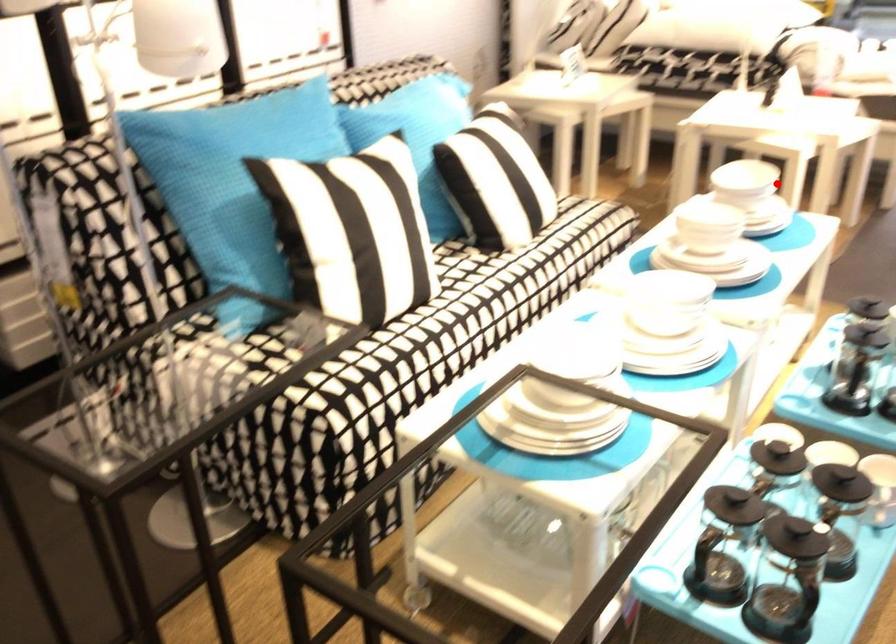
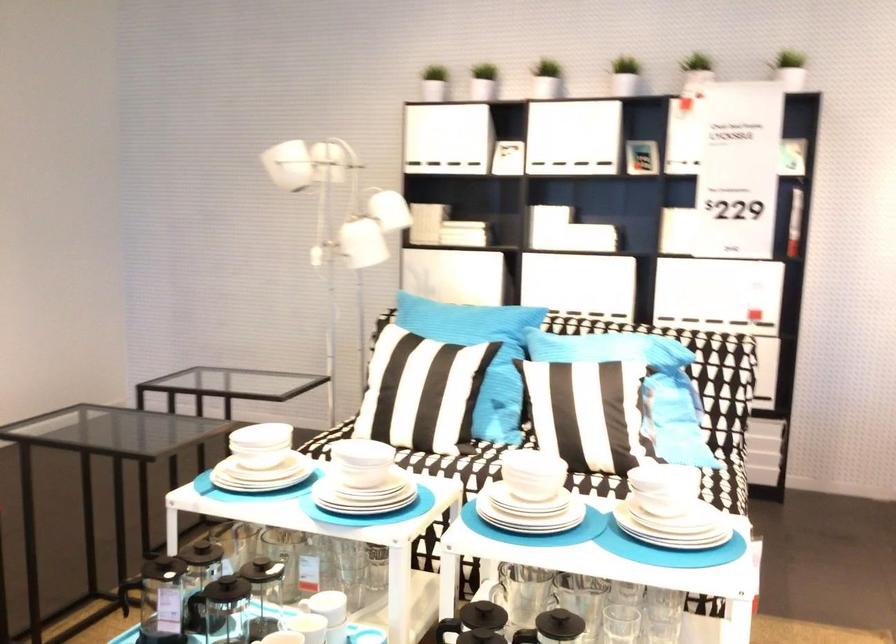
The point at the highlighted location is marked in the first image. Where is the corresponding point in the second image?

(661, 489)